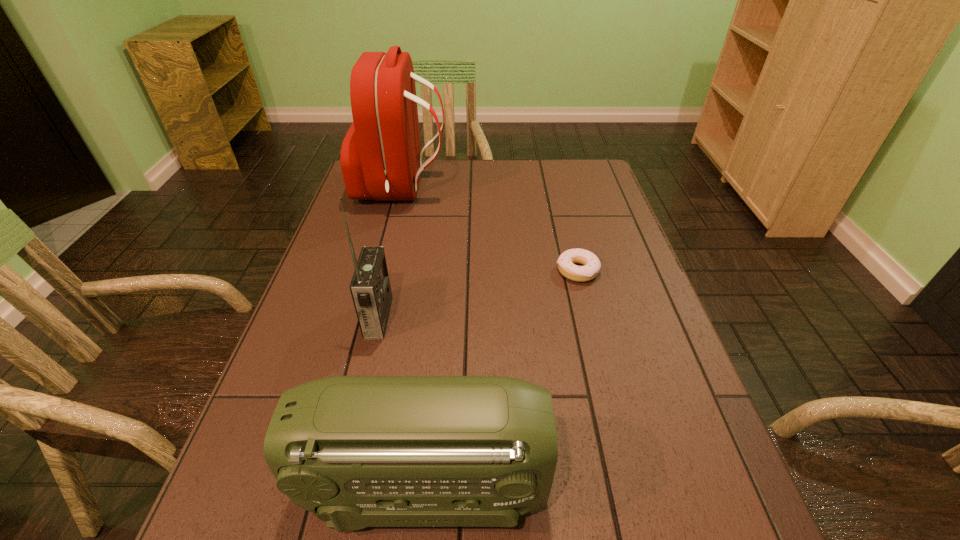
The height and width of the screenshot is (540, 960). In order to click on backpack present at the left edge in this screenshot , I will do `click(380, 157)`.

You are a GUI agent. You are given a task and a screenshot of the screen. Output one action in this format:
    pyautogui.click(x=<x>, y=<y>)
    Task: Click on the radio receiver located at the left edge
    This screenshot has height=540, width=960.
    Given the screenshot: What is the action you would take?
    pos(370,288)

At what (x,y) coordinates should I click in order to perform the action: click on object present at the right edge. Please return your answer as a coordinate pair (x, y). Image resolution: width=960 pixels, height=540 pixels. Looking at the image, I should click on (566, 262).

Image resolution: width=960 pixels, height=540 pixels. Find the location of `object present at the far left corner`. object present at the far left corner is located at coordinates (380, 157).

In the image, there is a desktop. Identify the location of vacant space at the far edge. Image resolution: width=960 pixels, height=540 pixels. (531, 159).

Where is `vacant space at the left edge of the desktop`? vacant space at the left edge of the desktop is located at coordinates (269, 382).

In the image, there is a desktop. Where is `vacant space at the right edge`? The height and width of the screenshot is (540, 960). vacant space at the right edge is located at coordinates (586, 238).

Identify the location of free spot between the shortest object and the third shortest object. The image size is (960, 540). (478, 294).

At what (x,y) coordinates should I click in order to perform the action: click on free space between the taller radio_receiver and the doughnut. Please return your answer as a coordinate pair (x, y). This screenshot has height=540, width=960. Looking at the image, I should click on (478, 294).

Image resolution: width=960 pixels, height=540 pixels. Find the location of `free space between the rightmost object and the tallest object`. free space between the rightmost object and the tallest object is located at coordinates (490, 230).